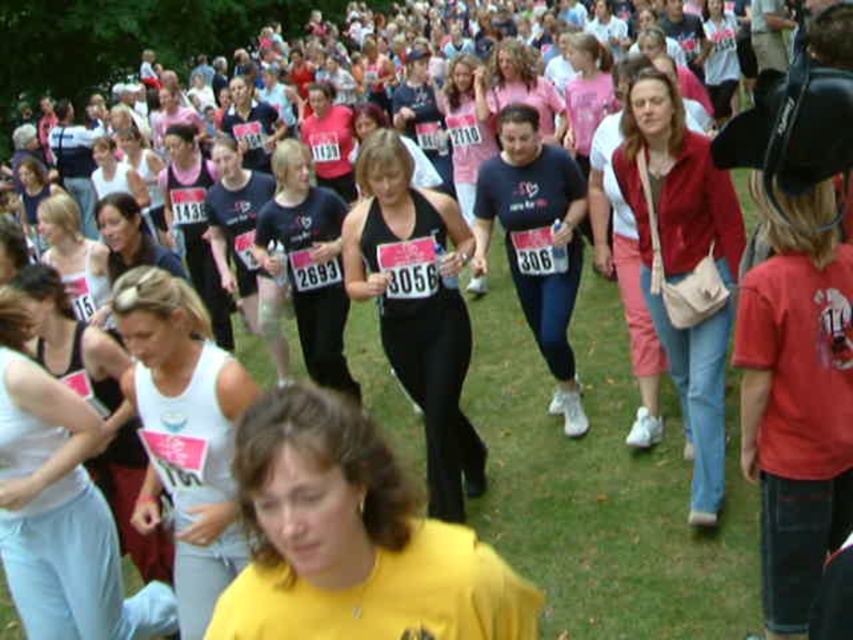
Based on the photo, you are a photographer at the charity event and want to take a photo of both the white matte tank top at center and the matte black tank top at center. Which one should you focus on first if you want to capture them in order from left to right?

The white matte tank top at center is to the left of the matte black tank top at center, so you should focus on the white matte tank top at center first to capture them in order from left to right.

You are a photographer at the charity event and want to capture both the yellow matte shirt at center and the velvet red jacket at center in a single photo. Which object should you focus on first to ensure both are in frame?

The yellow matte shirt at center is smaller than the velvet red jacket at center, so you should focus on the larger velvet red jacket at center first to ensure both are in frame.